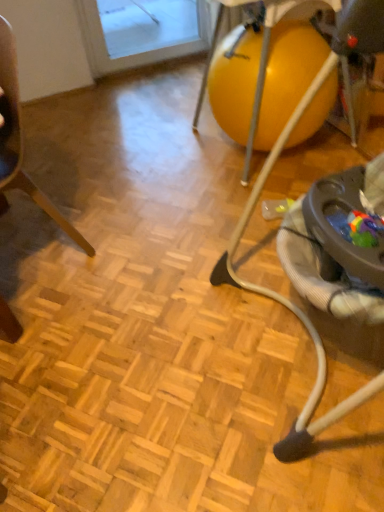
You are a GUI agent. You are given a task and a screenshot of the screen. Output one action in this format:
    pyautogui.click(x=<x>, y=<y>)
    Task: Click on the vacant space behind wooden chair at left
    
    Given the screenshot: What is the action you would take?
    pyautogui.click(x=71, y=188)